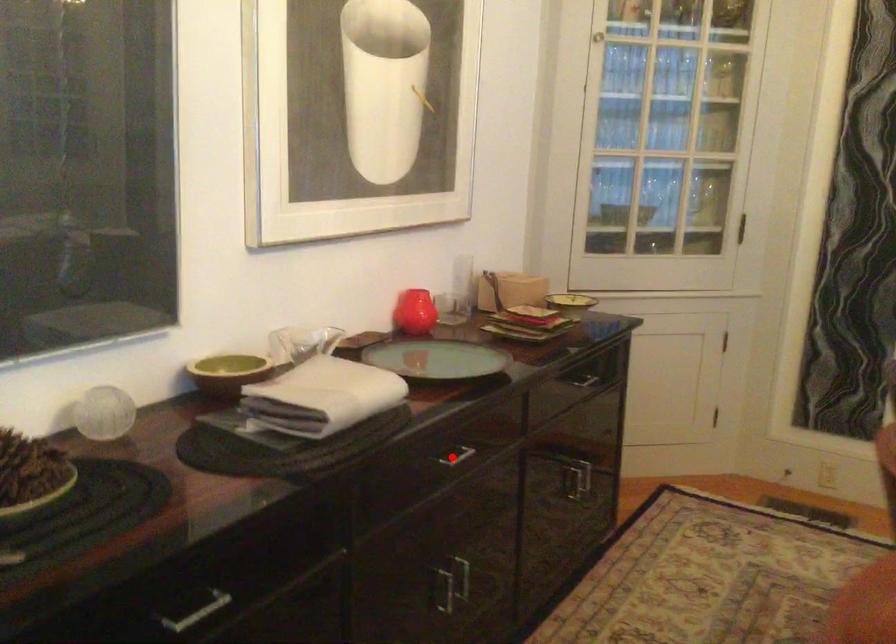
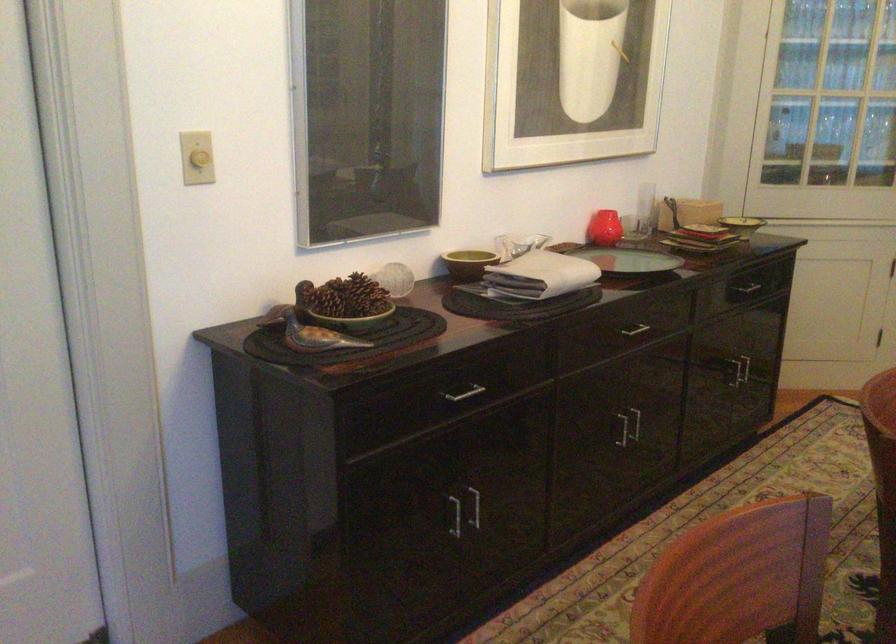
Find the pixel in the second image that matches the highlighted location in the first image.

(634, 328)